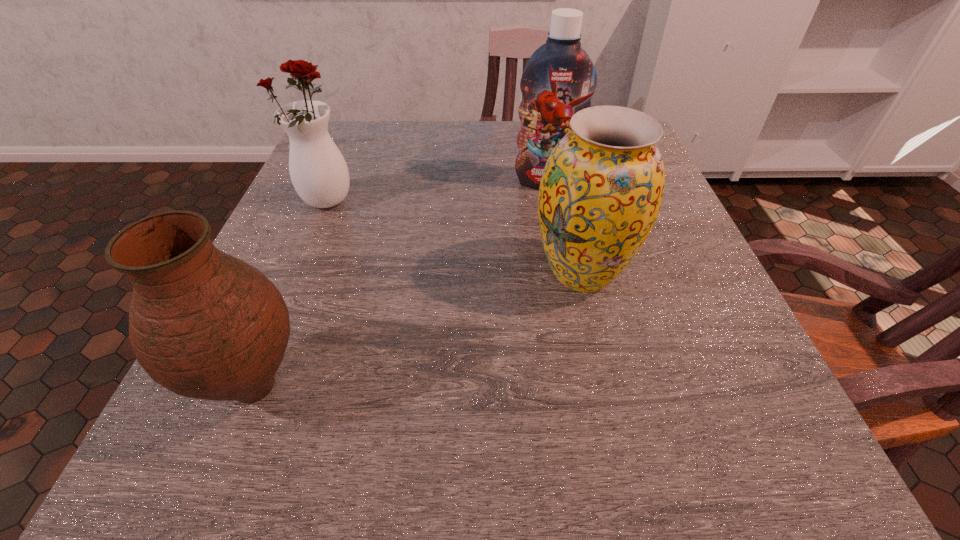
The height and width of the screenshot is (540, 960). I want to click on blank area in the image that satisfies the following two spatial constraints: 1. on the front label of the shampoo; 2. on the left side of the second nearest vase, so click(564, 273).

Where is `free spot that satisfies the following two spatial constraints: 1. on the front label of the shampoo; 2. on the left side of the second nearest vase`? free spot that satisfies the following two spatial constraints: 1. on the front label of the shampoo; 2. on the left side of the second nearest vase is located at coordinates (564, 273).

This screenshot has height=540, width=960. What are the coordinates of `vacant space that satisfies the following two spatial constraints: 1. on the front side of the farthest vase; 2. on the right side of the nearest object` in the screenshot? It's located at (251, 387).

Where is `free region that satisfies the following two spatial constraints: 1. on the front side of the second farthest vase; 2. on the right side of the farthest vase`? Image resolution: width=960 pixels, height=540 pixels. free region that satisfies the following two spatial constraints: 1. on the front side of the second farthest vase; 2. on the right side of the farthest vase is located at coordinates (298, 273).

At what (x,y) coordinates should I click in order to perform the action: click on vacant space that satisfies the following two spatial constraints: 1. on the front label of the third farthest object; 2. on the left side of the shampoo. Please return your answer as a coordinate pair (x, y). The width and height of the screenshot is (960, 540). Looking at the image, I should click on (564, 273).

Where is `free space that satisfies the following two spatial constraints: 1. on the front label of the second farthest vase; 2. on the right side of the shampoo`? free space that satisfies the following two spatial constraints: 1. on the front label of the second farthest vase; 2. on the right side of the shampoo is located at coordinates [x=564, y=273].